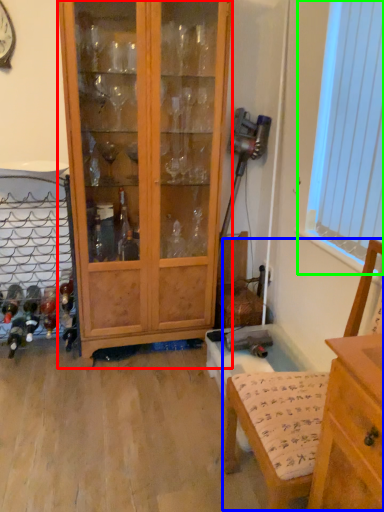
Question: Estimate the real-world distances between objects in this image. Which object is farther from cabinetry (highlighted by a red box), armchair (highlighted by a blue box) or window screen (highlighted by a green box)?

Choices:
 (A) armchair
 (B) window screen

Answer: (A)